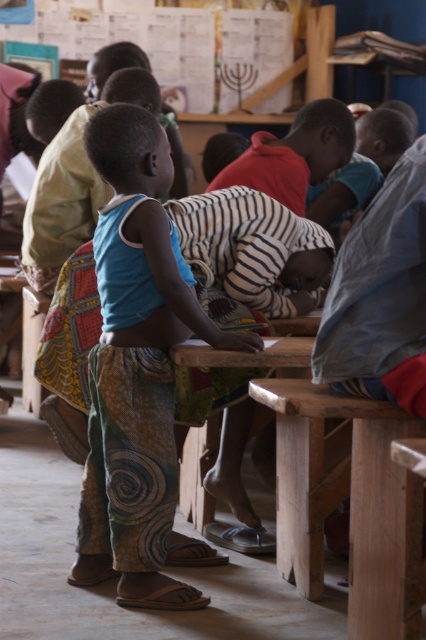
You are a student in the classroom and you see two points marked on the wall. One is at point [287,193] and the other is at point [267,340]. Which point is closer to you?

Point [287,193] is closer to you because it is further to the viewer than point [267,340].

Where is the blue cotton shirt at center located in the image?

The blue cotton shirt at center is located at point (x=137, y=368).

You are a teacher in the classroom. You notice two children wearing shirts at the center of the image. The shirts are labeled as the blue cotton shirt at center and the striped fabric shirt at center. Which child is wearing the shirt that is positioned lower?

The blue cotton shirt at center is below the striped fabric shirt at center, so the child wearing the blue cotton shirt at center has the shirt positioned lower.